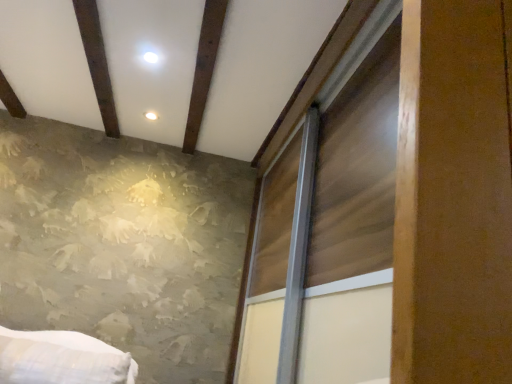
The width and height of the screenshot is (512, 384). What do you see at coordinates (354, 212) in the screenshot?
I see `wooden sliding door at right` at bounding box center [354, 212].

Locate an element on the screen. This screenshot has height=384, width=512. wooden sliding door at right is located at coordinates tap(354, 212).

The height and width of the screenshot is (384, 512). What do you see at coordinates (204, 69) in the screenshot?
I see `brown wooden plank at upper center` at bounding box center [204, 69].

Image resolution: width=512 pixels, height=384 pixels. What are the coordinates of `brown wooden plank at upper center` in the screenshot? It's located at (204, 69).

This screenshot has height=384, width=512. In order to click on wooden sliding door at right in this screenshot , I will do `click(354, 212)`.

Can you confirm if brown wooden plank at upper center is positioned to the left of wooden sliding door at right?

Yes.

Is brown wooden plank at upper center in front of or behind wooden sliding door at right in the image?

brown wooden plank at upper center is positioned farther from the viewer than wooden sliding door at right.

Is point (214, 48) positioned in front of point (327, 350)?

No.

From the image's perspective, would you say brown wooden plank at upper center is positioned over wooden sliding door at right?

Indeed, from the image's perspective, brown wooden plank at upper center is shown above wooden sliding door at right.

From a real-world perspective, which object stands above the other?

brown wooden plank at upper center, from a real-world perspective.

In the scene shown: Considering the relative sizes of brown wooden plank at upper center and wooden sliding door at right in the image provided, is brown wooden plank at upper center thinner than wooden sliding door at right?

Yes.

Can you confirm if brown wooden plank at upper center is shorter than wooden sliding door at right?

Yes, brown wooden plank at upper center is shorter than wooden sliding door at right.

Is brown wooden plank at upper center bigger than wooden sliding door at right?

Incorrect, brown wooden plank at upper center is not larger than wooden sliding door at right.

Do you think brown wooden plank at upper center is within wooden sliding door at right, or outside of it?

brown wooden plank at upper center is not enclosed by wooden sliding door at right.

Is brown wooden plank at upper center in contact with wooden sliding door at right?

They are not placed beside each other.

Is brown wooden plank at upper center facing towards wooden sliding door at right?

A: No, brown wooden plank at upper center is not turned towards wooden sliding door at right.

The width and height of the screenshot is (512, 384). Identify the location of plank located above the wooden sliding door at right (from a real-world perspective). (204, 69).

Considering the positions of objects wooden sliding door at right and brown wooden plank at upper center in the image provided, who is more to the left, wooden sliding door at right or brown wooden plank at upper center?

Positioned to the left is brown wooden plank at upper center.

Is wooden sliding door at right positioned behind brown wooden plank at upper center?

No, wooden sliding door at right is in front of brown wooden plank at upper center.

Does point (303, 375) come in front of point (215, 22)?

Yes, point (303, 375) is in front of point (215, 22).

From the image's perspective, between wooden sliding door at right and brown wooden plank at upper center, who is located below?

wooden sliding door at right is shown below in the image.

From a real-world perspective, which is physically above, wooden sliding door at right or brown wooden plank at upper center?

brown wooden plank at upper center is physically above.

Can you confirm if wooden sliding door at right is thinner than brown wooden plank at upper center?

No.

Does wooden sliding door at right have a lesser height compared to brown wooden plank at upper center?

Incorrect, the height of wooden sliding door at right does not fall short of that of brown wooden plank at upper center.

Who is smaller, wooden sliding door at right or brown wooden plank at upper center?

brown wooden plank at upper center.

Is brown wooden plank at upper center surrounded by wooden sliding door at right?

No, brown wooden plank at upper center is located outside of wooden sliding door at right.

From the picture: Is wooden sliding door at right far from brown wooden plank at upper center?

No.

Could you tell me if wooden sliding door at right is turned towards brown wooden plank at upper center?

Yes, wooden sliding door at right faces towards brown wooden plank at upper center.

There is a wooden sliding door at right. Identify the location of plank above it (from a real-world perspective). The image size is (512, 384). (204, 69).

Image resolution: width=512 pixels, height=384 pixels. I want to click on window below the brown wooden plank at upper center (from the image's perspective), so click(354, 212).

I want to click on window that appears on the right of brown wooden plank at upper center, so click(x=354, y=212).